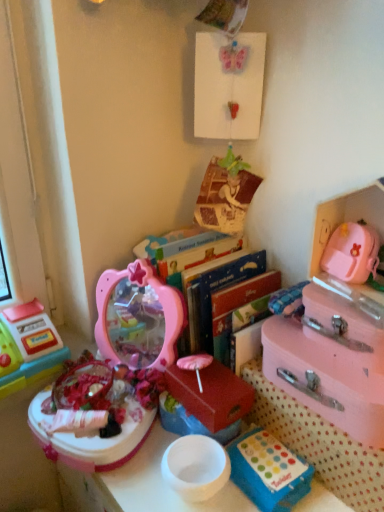
Question: Should I look upward or downward to see plastic toy cash register at left, the first toy in the left-to-right sequence?

Choices:
 (A) up
 (B) down

Answer: (B)

Question: From the image's perspective, is pastel pink suitcase at right, the 2th storage box viewed from the right, above blue plastic storage box at lower center, the 2th storage box positioned from the left?

Choices:
 (A) no
 (B) yes

Answer: (B)

Question: Is pastel pink suitcase at right, the 2th storage box viewed from the right, next to blue plastic storage box at lower center, the 2th storage box positioned from the left?

Choices:
 (A) yes
 (B) no

Answer: (A)

Question: Could you tell me if pastel pink suitcase at right, the 2th storage box viewed from the right, is turned towards blue plastic storage box at lower center, acting as the 3th storage box starting from the right?

Choices:
 (A) no
 (B) yes

Answer: (B)

Question: Does pastel pink suitcase at right, the 2th storage box viewed from the right, lie behind blue plastic storage box at lower center, acting as the 3th storage box starting from the right?

Choices:
 (A) no
 (B) yes

Answer: (A)

Question: Is pastel pink suitcase at right, the 2th storage box viewed from the right, facing away from blue plastic storage box at lower center, the 2th storage box positioned from the left?

Choices:
 (A) no
 (B) yes

Answer: (A)

Question: From a real-world perspective, is pastel pink suitcase at right, which is the third storage box in left-to-right order, under blue plastic storage box at lower center, acting as the 3th storage box starting from the right?

Choices:
 (A) no
 (B) yes

Answer: (A)

Question: From the image's perspective, does hardcover books at center appear higher than blue plastic storage box at lower center, the 2th storage box positioned from the left?

Choices:
 (A) yes
 (B) no

Answer: (A)

Question: Can you confirm if hardcover books at center is bigger than blue plastic storage box at lower center, the 2th storage box positioned from the left?

Choices:
 (A) no
 (B) yes

Answer: (B)

Question: Is hardcover books at center located outside blue plastic storage box at lower center, acting as the 3th storage box starting from the right?

Choices:
 (A) yes
 (B) no

Answer: (A)

Question: Does hardcover books at center come in front of blue plastic storage box at lower center, acting as the 3th storage box starting from the right?

Choices:
 (A) no
 (B) yes

Answer: (A)

Question: From the image's perspective, is hardcover books at center below blue plastic storage box at lower center, the 2th storage box positioned from the left?

Choices:
 (A) no
 (B) yes

Answer: (A)

Question: Is hardcover books at center oriented towards blue plastic storage box at lower center, acting as the 3th storage box starting from the right?

Choices:
 (A) no
 (B) yes

Answer: (A)

Question: Does pink matte suitcase at right, which appears as the 1th storage box when viewed from the right, have a greater height compared to plastic toy cash register at left, the first toy in the left-to-right sequence?

Choices:
 (A) no
 (B) yes

Answer: (A)